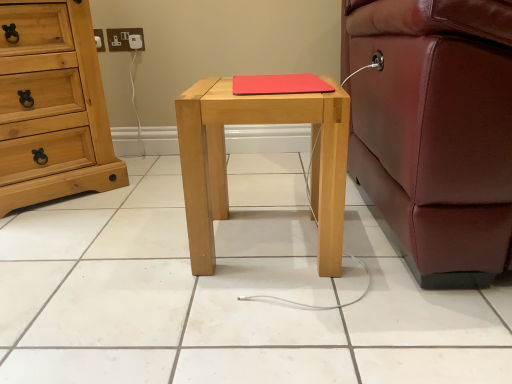
Identify the location of vacant space in light wood/texture nightstand at center (from a real-world perspective). Image resolution: width=512 pixels, height=384 pixels. (265, 242).